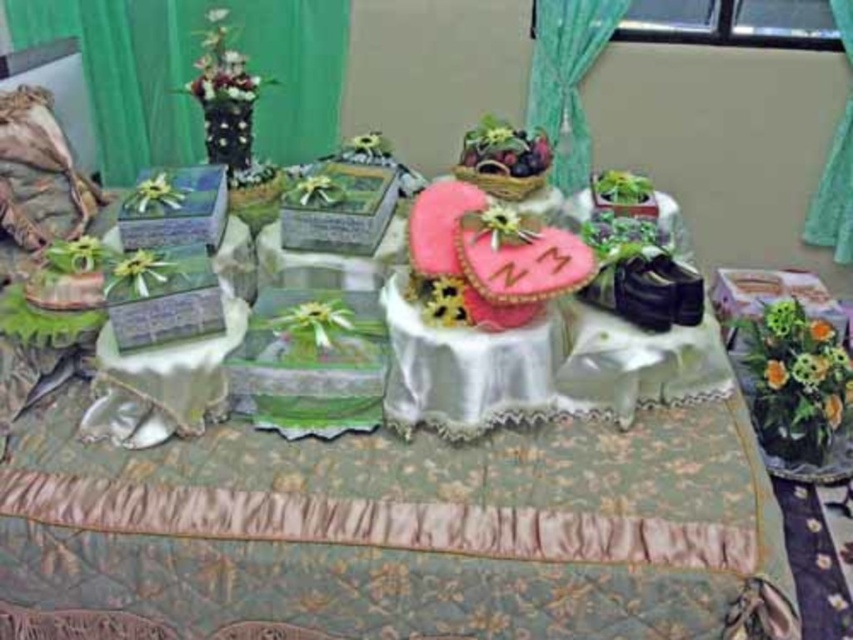
You are a guest at a wedding reception and want to take a photo of the table. You notice the silky white tablecloth at center and the green sheer curtain at upper center. Which object should you focus on first if you want to capture both in a single frame without moving the camera?

You should focus on the silky white tablecloth at center first because it is positioned to the left of the green sheer curtain at upper center, so capturing it first ensures both objects are in the frame without needing to adjust the camera position.